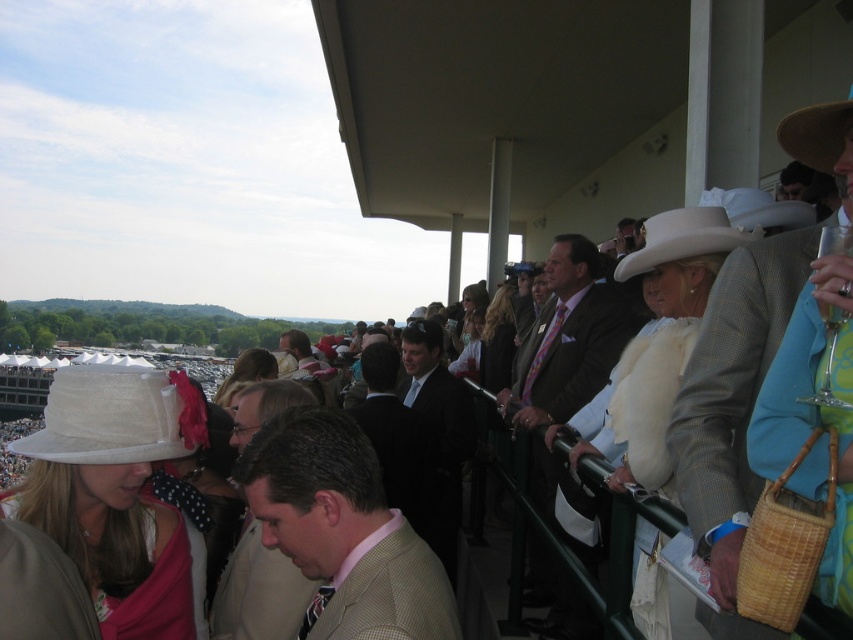
You are a photographer trying to capture a candid shot of the light brown leather jacket at center and the white fabric hat at left. Since you want to ensure both subjects are in focus, you need to know which one is smaller in the frame. Which object takes up less space in the image?

The light brown leather jacket at center occupies less space than the white fabric hat at left, so the light brown leather jacket at center is smaller in the frame and will be easier to keep in focus.

You are standing at the grandstand and want to take a photo of the two points marked in the scene. Which point, point (570, 417) or point (20, 445), is closer to your camera?

Point (20, 445) is closer to the camera because it is less further to the camera than point (570, 417).

You are attending a horse race event and notice two gentlemen in the foreground. One is wearing a tan textured suit at center, and the other is in a black suit at center. From your perspective, which gentleman is standing to the left of the other?

The tan textured suit at center is positioned on the left side of black suit at center, so the gentleman in the tan textured suit at center is standing to the left of the one in the black suit at center.